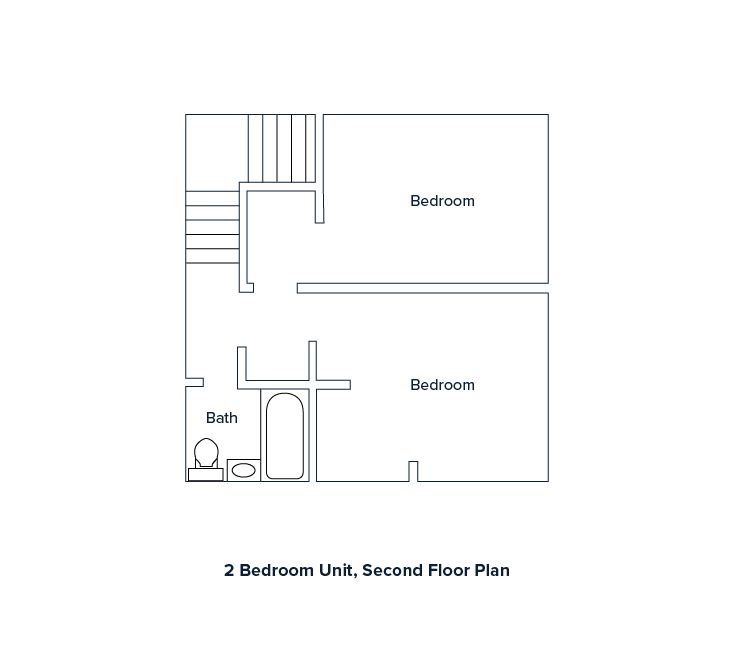
Where is `doorways`? Image resolution: width=734 pixels, height=649 pixels. doorways is located at coordinates (216, 381), (272, 287), (239, 317), (316, 315).